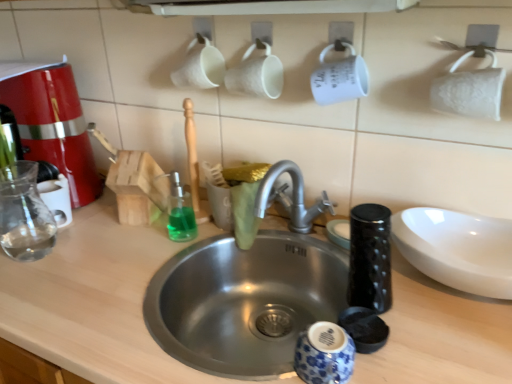
You are a GUI agent. You are given a task and a screenshot of the screen. Output one action in this format:
    pyautogui.click(x=<x>, y=<y>)
    Task: Click on the unoccupied area behind green translucent liquid at sink
    Image resolution: width=512 pixels, height=384 pixels.
    Given the screenshot: What is the action you would take?
    183,221